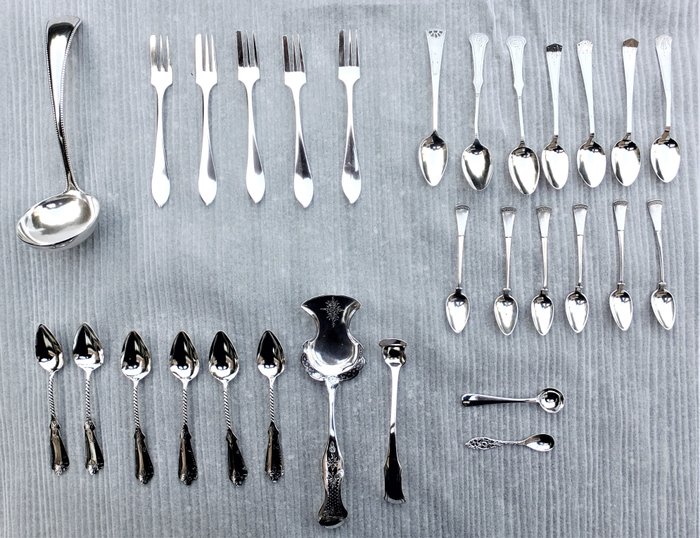
I want to click on forks, so click(x=160, y=82), click(x=202, y=79), click(x=246, y=77), click(x=290, y=82), click(x=346, y=76).